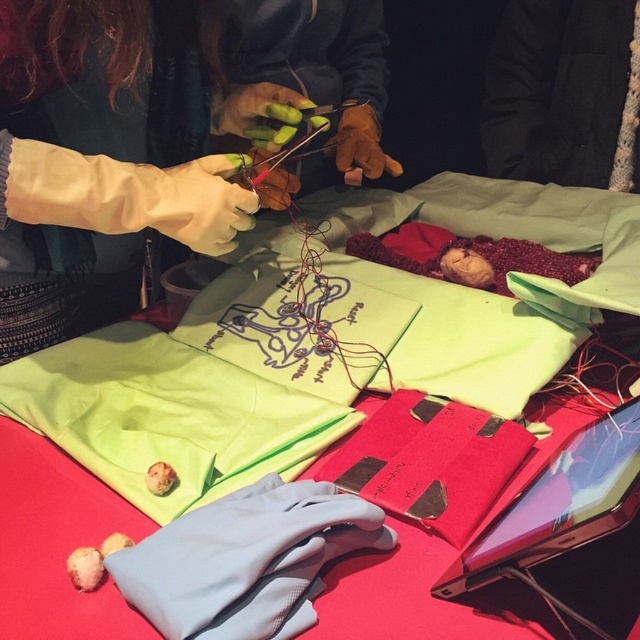
Does matte green fabric at center have a greater width compared to green fabric at center?

Yes, matte green fabric at center is wider than green fabric at center.

Describe the element at coordinates (492, 294) in the screenshot. This screenshot has height=640, width=640. I see `matte green fabric at center` at that location.

Find the location of `matte green fabric at center`. matte green fabric at center is located at coordinates click(x=492, y=294).

Does gray fleece glove at lower left have a greater width compared to matte yellow gloves at center?

Incorrect, gray fleece glove at lower left's width does not surpass matte yellow gloves at center's.

Find the location of a particular element. gray fleece glove at lower left is located at coordinates (246, 561).

Image resolution: width=640 pixels, height=640 pixels. What do you see at coordinates (492, 294) in the screenshot?
I see `matte green fabric at center` at bounding box center [492, 294].

Which is more to the right, matte green fabric at center or gray fleece glove at lower left?

matte green fabric at center

Describe the element at coordinates (492, 294) in the screenshot. I see `matte green fabric at center` at that location.

At what (x,y) coordinates should I click in order to perform the action: click on matte green fabric at center. Please return your answer as a coordinate pair (x, y). The image size is (640, 640). Looking at the image, I should click on (492, 294).